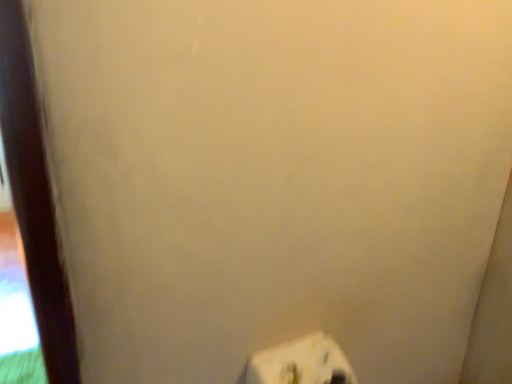
What is the approximate height of white plastic power plugs and sockets at lower right?

6.07 inches.

Find the location of a particular element. This screenshot has height=384, width=512. white plastic power plugs and sockets at lower right is located at coordinates (301, 363).

Describe the element at coordinates (301, 363) in the screenshot. This screenshot has height=384, width=512. I see `white plastic power plugs and sockets at lower right` at that location.

You are a GUI agent. You are given a task and a screenshot of the screen. Output one action in this format:
    pyautogui.click(x=<x>, y=<y>)
    Task: Click on the white plastic power plugs and sockets at lower right
    
    Given the screenshot: What is the action you would take?
    pyautogui.click(x=301, y=363)